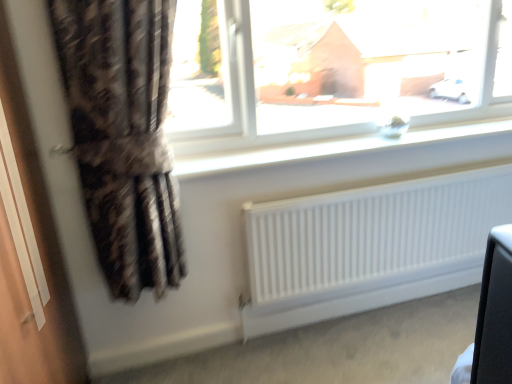
Locate an element on the screen. plaid fabric curtain at left is located at coordinates [123, 136].

Describe the element at coordinates (356, 70) in the screenshot. I see `transparent glass window at upper center` at that location.

Consider the image. Measure the distance between point (332,89) and camera.

The depth of point (332,89) is 27.68 feet.

You are a GUI agent. You are given a task and a screenshot of the screen. Output one action in this format:
    pyautogui.click(x=<x>, y=<y>)
    Task: Click on the white matte radiator at lower center
    
    Given the screenshot: What is the action you would take?
    pyautogui.click(x=372, y=235)

Are plaid fabric curtain at left and transparent glass window at upper center far apart?

plaid fabric curtain at left is far away from transparent glass window at upper center.

Measure the distance from plaid fabric curtain at left to transparent glass window at upper center.

plaid fabric curtain at left and transparent glass window at upper center are 2.27 meters apart from each other.

Relative to transparent glass window at upper center, is plaid fabric curtain at left in front or behind?

plaid fabric curtain at left is in front of transparent glass window at upper center.

This screenshot has width=512, height=384. Find the location of `curtain below the transparent glass window at upper center (from a real-world perspective)`. curtain below the transparent glass window at upper center (from a real-world perspective) is located at coordinates (123, 136).

Is point (376, 254) farther from camera compared to point (314, 158)?

Yes, point (376, 254) is behind point (314, 158).

Consider the image. Are white matte radiator at lower center and white smooth window sill at upper center located far from each other?

No, white matte radiator at lower center is not far away from white smooth window sill at upper center.

Is white matte radiator at lower center aimed at white smooth window sill at upper center?

No.

Is white smooth window sill at upper center thinner than plaid fabric curtain at left?

Incorrect, the width of white smooth window sill at upper center is not less than that of plaid fabric curtain at left.

Is white smooth window sill at upper center oriented away from plaid fabric curtain at left?

That's not correct — white smooth window sill at upper center is not looking away from plaid fabric curtain at left.

Is point (359, 146) closer or farther from the camera than point (163, 285)?

Point (359, 146).

From a real-world perspective, who is located lower, white smooth window sill at upper center or plaid fabric curtain at left?

In real-world perspective, white smooth window sill at upper center is lower.

Is plaid fabric curtain at left positioned with its back to white matte radiator at lower center?

No, plaid fabric curtain at left's orientation is not away from white matte radiator at lower center.

From a real-world perspective, which object stands above the other?

plaid fabric curtain at left is physically above.

Considering the sizes of objects plaid fabric curtain at left and white matte radiator at lower center in the image provided, who is taller, plaid fabric curtain at left or white matte radiator at lower center?

plaid fabric curtain at left is taller.

Considering the sizes of objects plaid fabric curtain at left and white matte radiator at lower center in the image provided, who is thinner, plaid fabric curtain at left or white matte radiator at lower center?

white matte radiator at lower center is thinner.

Between white smooth window sill at upper center and transparent glass window at upper center, which one is positioned in front?

Positioned in front is transparent glass window at upper center.

Is white smooth window sill at upper center taller than transparent glass window at upper center?

No, white smooth window sill at upper center is not taller than transparent glass window at upper center.

Where is `window located on the left of white smooth window sill at upper center`? window located on the left of white smooth window sill at upper center is located at coordinates (356, 70).

Can you see white smooth window sill at upper center touching transparent glass window at upper center?

No, white smooth window sill at upper center is not next to transparent glass window at upper center.

Considering the positions of objects transparent glass window at upper center and plaid fabric curtain at left in the image provided, who is behind, transparent glass window at upper center or plaid fabric curtain at left?

transparent glass window at upper center.

From the image's perspective, is transparent glass window at upper center located above plaid fabric curtain at left?

Yes, from the image's perspective, transparent glass window at upper center is over plaid fabric curtain at left.

Is transparent glass window at upper center spatially inside plaid fabric curtain at left, or outside of it?

transparent glass window at upper center is located beyond the bounds of plaid fabric curtain at left.

Could you tell me if transparent glass window at upper center is facing white smooth window sill at upper center?

No, transparent glass window at upper center is not aimed at white smooth window sill at upper center.

Where is `window located in front of the white smooth window sill at upper center`? The image size is (512, 384). window located in front of the white smooth window sill at upper center is located at coordinates (356, 70).

Is transparent glass window at upper center behind white smooth window sill at upper center?

No, it is not.

Considering the sizes of transparent glass window at upper center and white smooth window sill at upper center in the image, is transparent glass window at upper center bigger or smaller than white smooth window sill at upper center?

In the image, transparent glass window at upper center appears to be larger than white smooth window sill at upper center.

This screenshot has width=512, height=384. In order to click on window behind the plaid fabric curtain at left in this screenshot , I will do `click(356, 70)`.

This screenshot has width=512, height=384. Find the location of `radiator below the white smooth window sill at upper center (from the image's perspective)`. radiator below the white smooth window sill at upper center (from the image's perspective) is located at coordinates pyautogui.click(x=372, y=235).

Looking at the image, which one is located closer to white smooth window sill at upper center, transparent glass window at upper center or plaid fabric curtain at left?

Among the two, plaid fabric curtain at left is located nearer to white smooth window sill at upper center.

Which object lies further to the anchor point plaid fabric curtain at left, white smooth window sill at upper center or transparent glass window at upper center?

transparent glass window at upper center.

Which object lies nearer to the anchor point white smooth window sill at upper center, white matte radiator at lower center or plaid fabric curtain at left?

The object closer to white smooth window sill at upper center is white matte radiator at lower center.

Which object lies further to the anchor point transparent glass window at upper center, plaid fabric curtain at left or white matte radiator at lower center?

plaid fabric curtain at left is further to transparent glass window at upper center.

Which object lies further to the anchor point transparent glass window at upper center, plaid fabric curtain at left or white smooth window sill at upper center?

white smooth window sill at upper center is positioned further to the anchor transparent glass window at upper center.

Consider the image. Considering their positions, is white matte radiator at lower center positioned closer to white smooth window sill at upper center than transparent glass window at upper center?

white matte radiator at lower center.

Estimate the real-world distances between objects in this image. Which object is further from white matte radiator at lower center, transparent glass window at upper center or plaid fabric curtain at left?

The object further to white matte radiator at lower center is transparent glass window at upper center.

Which object lies further to the anchor point white matte radiator at lower center, transparent glass window at upper center or white smooth window sill at upper center?

transparent glass window at upper center is positioned further to the anchor white matte radiator at lower center.

You are a GUI agent. You are given a task and a screenshot of the screen. Output one action in this format:
    pyautogui.click(x=<x>, y=<y>)
    Task: Click on the window between plaid fabric curtain at left and white matte radiator at lower center from left to right
    
    Given the screenshot: What is the action you would take?
    pyautogui.click(x=356, y=70)

The image size is (512, 384). What are the coordinates of `window sill between plaid fabric curtain at left and white matte radiator at lower center from left to right` in the screenshot? It's located at [332, 148].

Identify the location of window sill that lies between transparent glass window at upper center and white matte radiator at lower center from top to bottom. This screenshot has height=384, width=512. (332, 148).

Where is `window between plaid fabric curtain at left and white smooth window sill at upper center from left to right`? window between plaid fabric curtain at left and white smooth window sill at upper center from left to right is located at coordinates click(x=356, y=70).